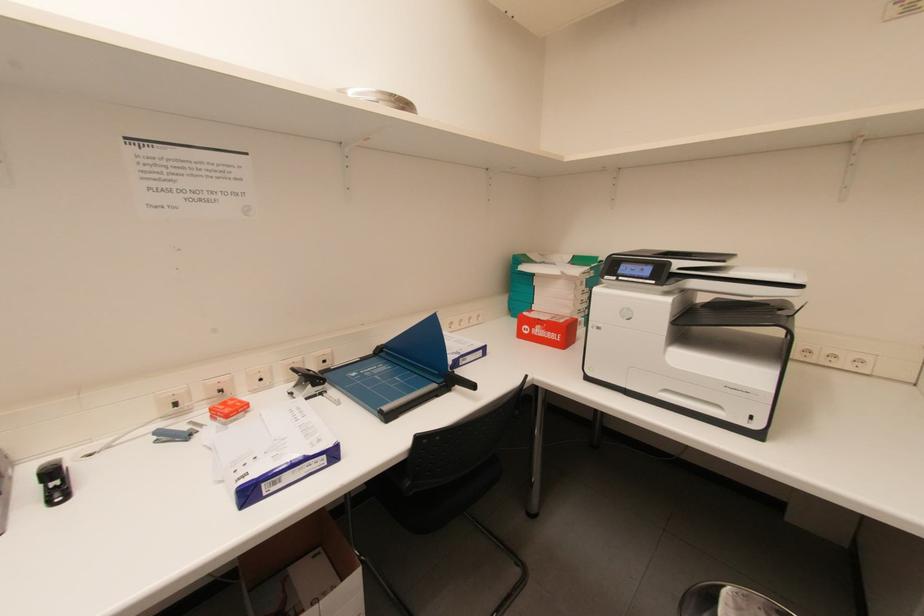
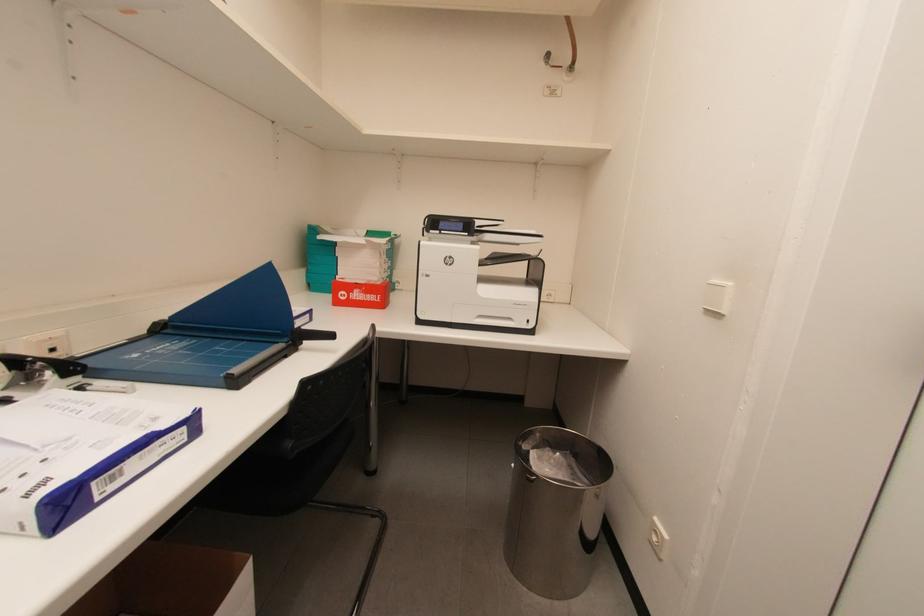
Question: The first image is from the beginning of the video and the second image is from the end. How did the camera likely rotate when shooting the video?

Choices:
 (A) Left
 (B) Right
 (C) Up
 (D) Down

Answer: (B)